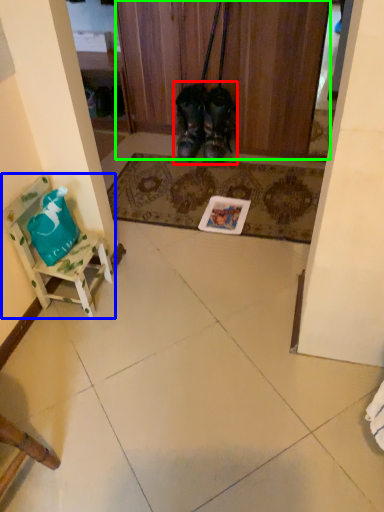
Question: Which object is the farthest from footwear (highlighted by a red box)? Choose among these: furniture (highlighted by a blue box) or door (highlighted by a green box).

Choices:
 (A) furniture
 (B) door

Answer: (A)